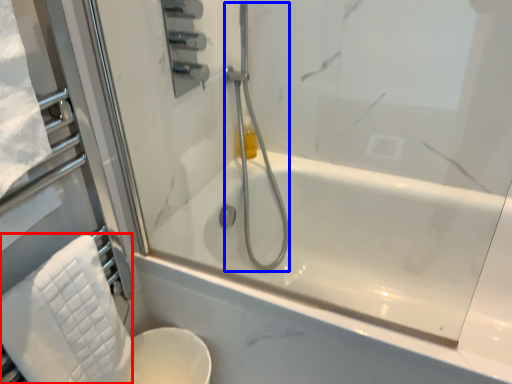
Question: Among these objects, which one is nearest to the camera, bath towel (highlighted by a red box) or shower (highlighted by a blue box)?

Choices:
 (A) bath towel
 (B) shower

Answer: (A)